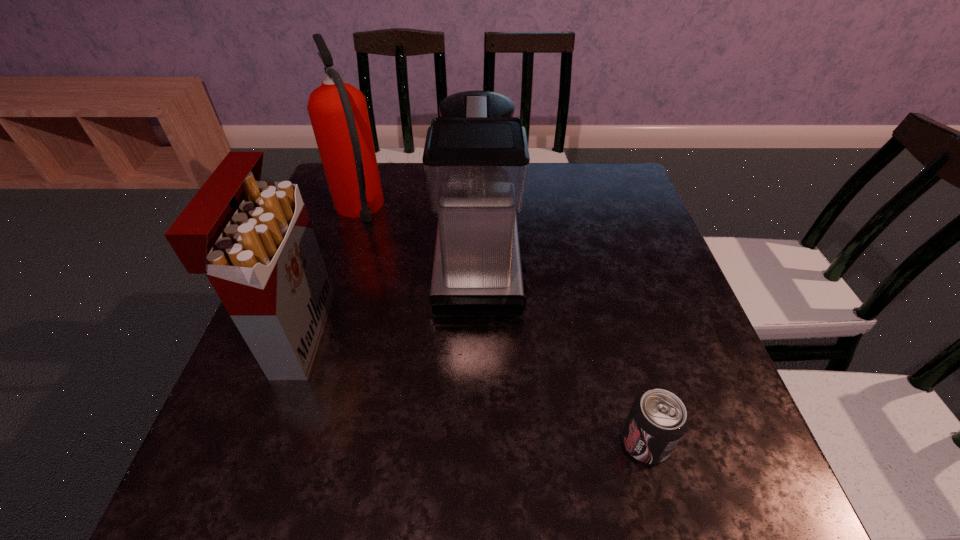
Identify the location of fire extinguisher. Image resolution: width=960 pixels, height=540 pixels. (338, 112).

Locate an element on the screen. The width and height of the screenshot is (960, 540). the second object from right to left is located at coordinates (476, 158).

The width and height of the screenshot is (960, 540). In order to click on cigarette case in this screenshot , I will do `click(254, 240)`.

This screenshot has height=540, width=960. In order to click on soda can in this screenshot , I will do `click(657, 420)`.

Locate an element on the screen. The height and width of the screenshot is (540, 960). the rightmost object is located at coordinates (657, 420).

In order to click on vacant area located 0.060m on the handle side of the fire extinguisher in this screenshot , I will do `click(371, 175)`.

Image resolution: width=960 pixels, height=540 pixels. What are the coordinates of `vacant area located 0.080m on the handle side of the fire extinguisher` in the screenshot? It's located at click(372, 171).

Locate an element on the screen. The height and width of the screenshot is (540, 960). vacant space located on the handle side of the fire extinguisher is located at coordinates (372, 171).

The height and width of the screenshot is (540, 960). I want to click on free space located 0.240m at the front of the coffee maker where the controls are located, so click(x=623, y=264).

Locate an element on the screen. vacant space located with the lid open on the cigarette case is located at coordinates (487, 334).